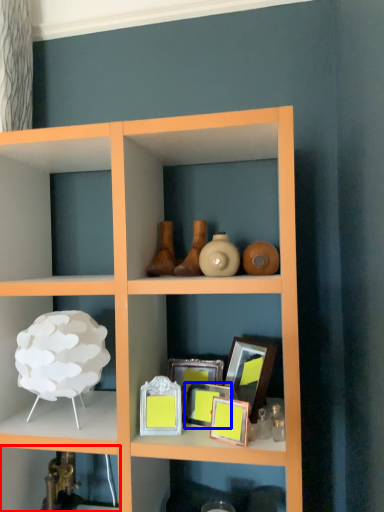
Question: Which object is further to the camera taking this photo, shelf (highlighted by a red box) or picture frame (highlighted by a blue box)?

Choices:
 (A) shelf
 (B) picture frame

Answer: (A)